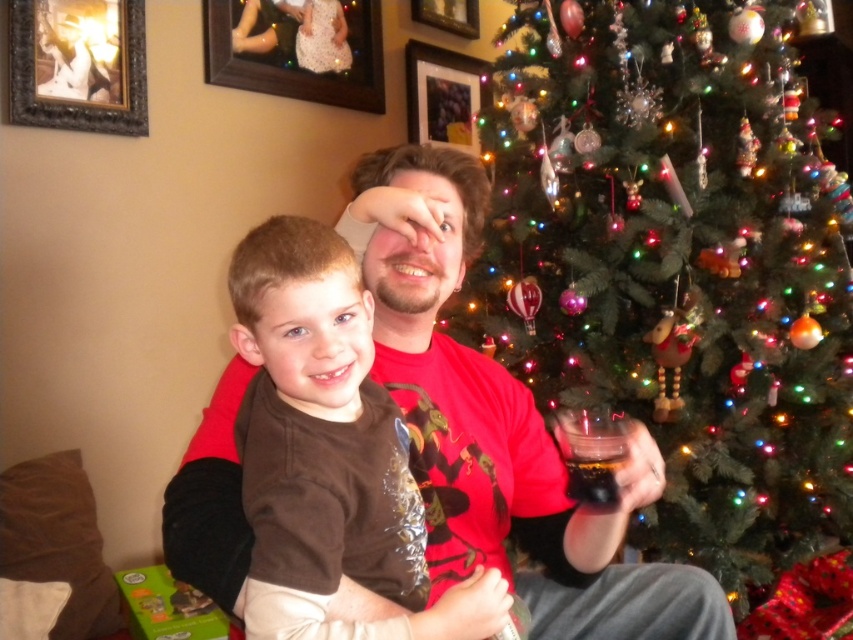
Question: Among these objects, which one is farthest from the camera?

Choices:
 (A) metallic silver frame at upper center
 (B) green matte christmas tree at right
 (C) brown soft shirt at center
 (D) dark glossy cup at right

Answer: (A)

Question: Can you confirm if red matte shirt at center is positioned to the right of brown soft shirt at center?

Choices:
 (A) no
 (B) yes

Answer: (B)

Question: Which object is closer to the camera taking this photo?

Choices:
 (A) matte glass picture frame at upper center
 (B) green matte christmas tree at right

Answer: (B)

Question: Can you confirm if gold-framed photo at upper left is bigger than metallic silver frame at upper center?

Choices:
 (A) yes
 (B) no

Answer: (B)

Question: Estimate the real-world distances between objects in this image. Which object is closer to the translucent plastic cup at right?

Choices:
 (A) dark glossy cup at right
 (B) red matte shirt at center
 (C) metallic silver frame at upper center
 (D) gold-framed photo at upper left

Answer: (A)

Question: Does green matte christmas tree at right come behind matte glass picture frame at upper center?

Choices:
 (A) no
 (B) yes

Answer: (A)